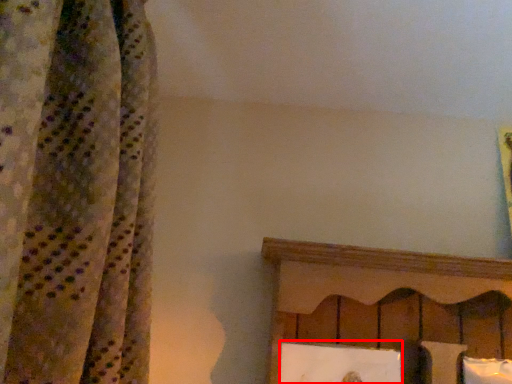
Question: From the image's perspective, what is the correct spatial relationship of picture frame (annotated by the red box) in relation to pillow?

Choices:
 (A) below
 (B) above

Answer: (B)